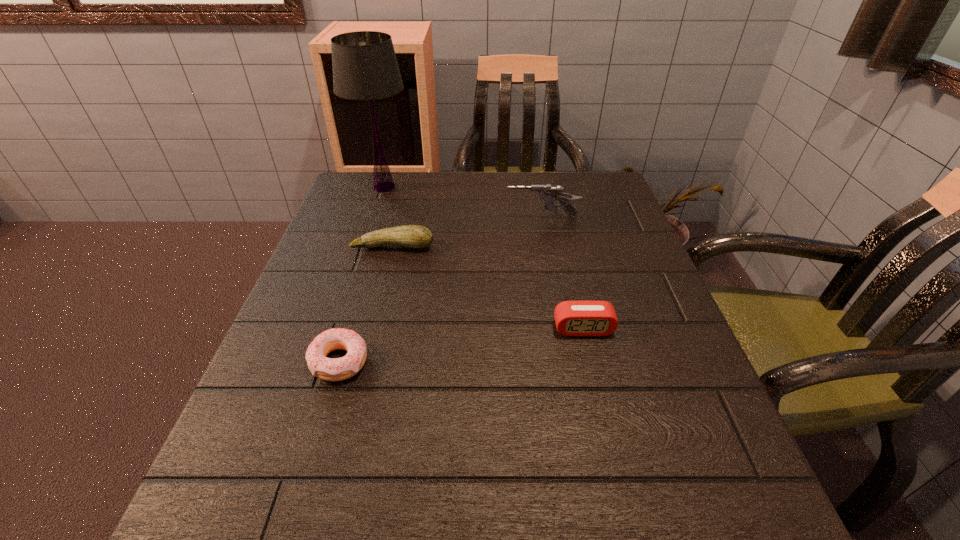
This screenshot has height=540, width=960. I want to click on vacant space located at the barrel of the fourth nearest object, so click(470, 218).

Where is `vacant space located 0.240m at the barrel of the fourth nearest object`? This screenshot has height=540, width=960. vacant space located 0.240m at the barrel of the fourth nearest object is located at coordinates (412, 218).

You are a GUI agent. You are given a task and a screenshot of the screen. Output one action in this format:
    pyautogui.click(x=<x>, y=<y>)
    Task: Click on the vacant area situated 0.320m on the front-facing side of the second nearest object
    
    Given the screenshot: What is the action you would take?
    pyautogui.click(x=629, y=519)

You are a GUI agent. You are given a task and a screenshot of the screen. Output one action in this format:
    pyautogui.click(x=<x>, y=<y>)
    Task: Click on the vacant region located 0.240m at the stem end of the third farthest object
    The height and width of the screenshot is (540, 960).
    Given the screenshot: What is the action you would take?
    [372, 332]

At what (x,y) coordinates should I click in order to perform the action: click on free space located 0.240m on the right of the shortest object. Please return your answer as a coordinate pair (x, y). Looking at the image, I should click on (503, 361).

Find the location of a particular element. The width and height of the screenshot is (960, 540). lampshade that is at the far edge is located at coordinates (365, 68).

This screenshot has width=960, height=540. I want to click on gun positioned at the far edge, so click(548, 193).

Where is `lampshade present at the left edge`? lampshade present at the left edge is located at coordinates (365, 68).

Where is `zucchini at the left edge`? This screenshot has height=540, width=960. zucchini at the left edge is located at coordinates click(412, 236).

Where is `doughnut at the left edge`? The width and height of the screenshot is (960, 540). doughnut at the left edge is located at coordinates (330, 369).